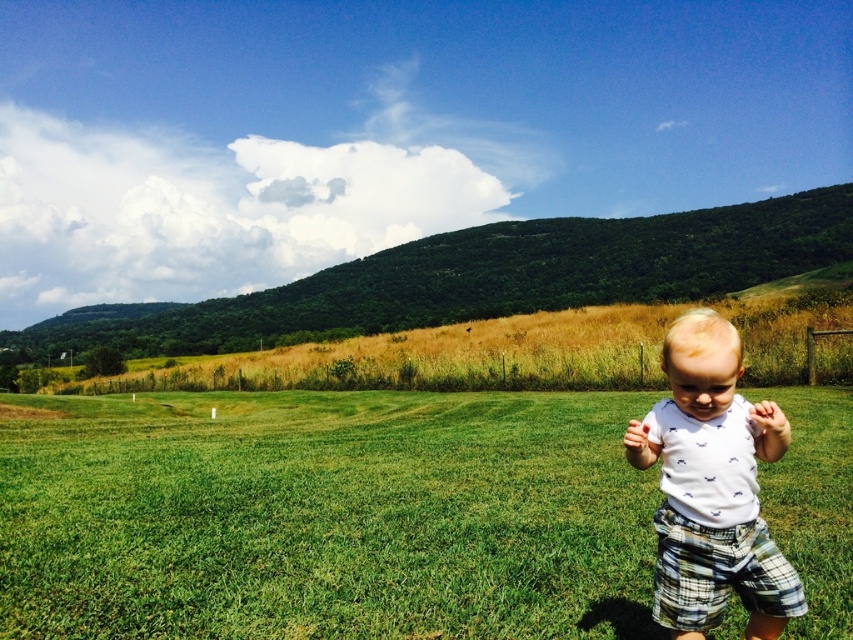
Is point (410, 444) in front of point (665, 513)?

That is False.

Describe the element at coordinates (323, 515) in the screenshot. I see `green grass at center` at that location.

Where is `green grass at center`? Image resolution: width=853 pixels, height=640 pixels. green grass at center is located at coordinates (323, 515).